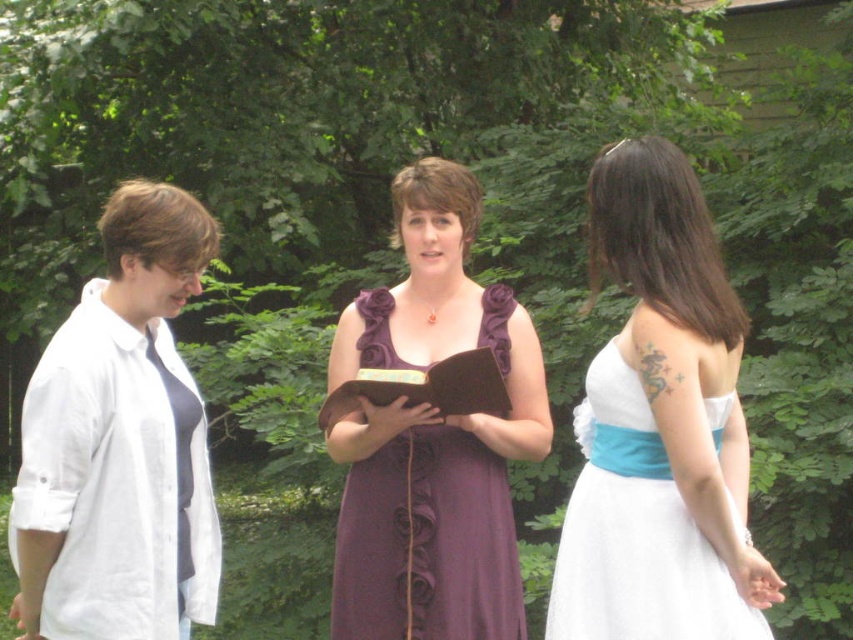
Between point (74, 605) and point (178, 529), which one is positioned in front?

Point (74, 605) is in front.

Is point (56, 476) positioned before point (190, 461)?

Yes, point (56, 476) is in front of point (190, 461).

Identify the location of white cotton shirt at left. The height and width of the screenshot is (640, 853). (120, 442).

Between white cotton shirt at left and purple satin dress at center, which one has less height?

With less height is purple satin dress at center.

Can you confirm if white cotton shirt at left is smaller than purple satin dress at center?

No.

Does point (175, 408) come farther from viewer compared to point (502, 344)?

No, (175, 408) is in front of (502, 344).

At what (x,y) coordinates should I click in order to perform the action: click on white cotton shirt at left. Please return your answer as a coordinate pair (x, y). This screenshot has height=640, width=853. Looking at the image, I should click on (120, 442).

Does white cotton shirt at left have a larger size compared to white satin dress at center?

Yes, white cotton shirt at left is bigger than white satin dress at center.

Where is `white cotton shirt at left`? white cotton shirt at left is located at coordinates (120, 442).